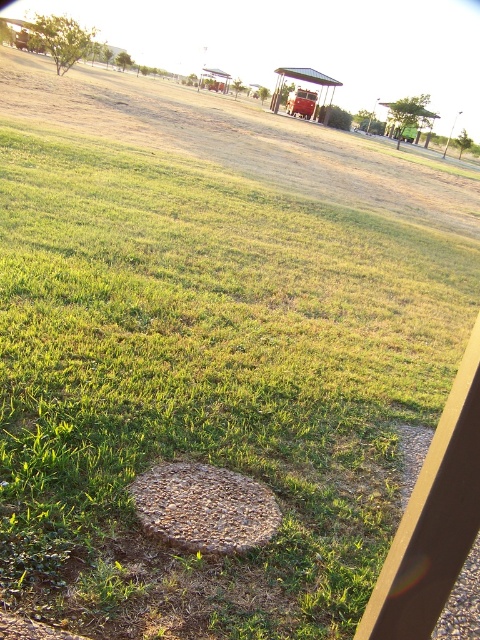
How far apart are granular concrete manhole at center and metallic circular object at lower center?

granular concrete manhole at center and metallic circular object at lower center are 1.57 meters apart.

Describe the element at coordinates (204, 508) in the screenshot. I see `granular concrete manhole at center` at that location.

Is point (255, 529) farther from camera compared to point (422, 576)?

Yes.

This screenshot has height=640, width=480. Find the location of `granular concrete manhole at center`. granular concrete manhole at center is located at coordinates (204, 508).